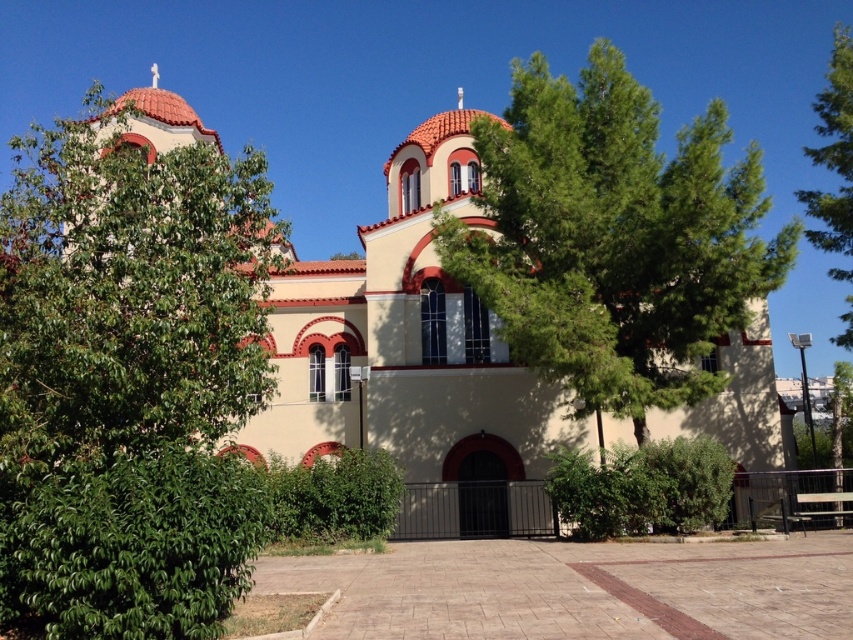
Question: Which object is the farthest from the green leafy tree at upper right?

Choices:
 (A) green leafy tree at left
 (B) green leafy tree at center

Answer: (A)

Question: Can you confirm if green leafy tree at center is positioned to the left of green leafy tree at upper right?

Choices:
 (A) yes
 (B) no

Answer: (A)

Question: Is green leafy tree at left closer to camera compared to green leafy tree at center?

Choices:
 (A) yes
 (B) no

Answer: (A)

Question: Which point appears closest to the camera in this image?

Choices:
 (A) (149, 243)
 (B) (780, 452)

Answer: (A)

Question: Is green leafy tree at left to the right of green leafy tree at center from the viewer's perspective?

Choices:
 (A) no
 (B) yes

Answer: (A)

Question: Which of these objects is positioned farthest from the green leafy tree at upper right?

Choices:
 (A) green leafy tree at left
 (B) beige stucco church at center

Answer: (A)